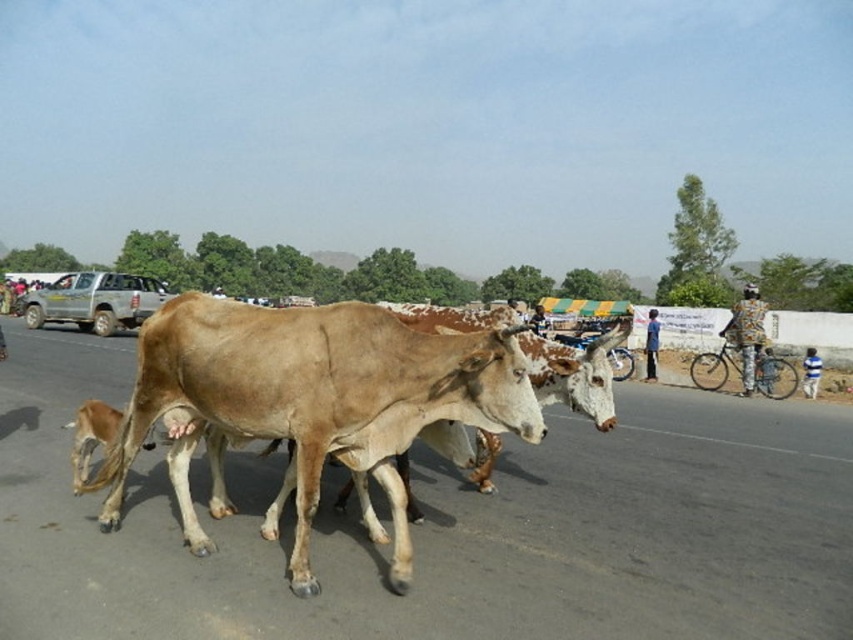
Question: Does light brown smooth cow at center have a greater width compared to silver metallic pickup truck at center?

Choices:
 (A) yes
 (B) no

Answer: (B)

Question: Is light brown smooth cow at center thinner than silver metallic pickup truck at center?

Choices:
 (A) no
 (B) yes

Answer: (B)

Question: Among these points, which one is farthest from the camera?

Choices:
 (A) (538, 438)
 (B) (83, 280)

Answer: (B)

Question: Which point appears closest to the camera in this image?

Choices:
 (A) (85, 308)
 (B) (169, 403)

Answer: (B)

Question: Does light brown smooth cow at center appear under silver metallic pickup truck at center?

Choices:
 (A) yes
 (B) no

Answer: (A)